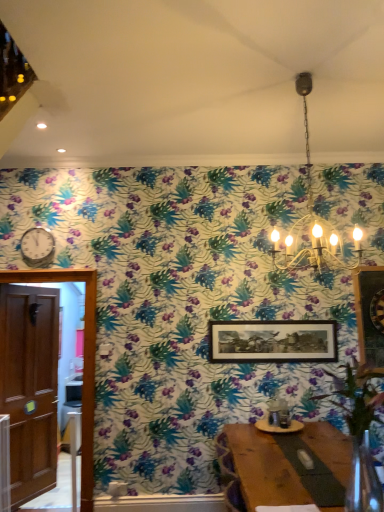
Where is `free location above metallic chandelier at upper center (from a real-world perspective)`? Image resolution: width=384 pixels, height=512 pixels. free location above metallic chandelier at upper center (from a real-world perspective) is located at coordinates (297, 76).